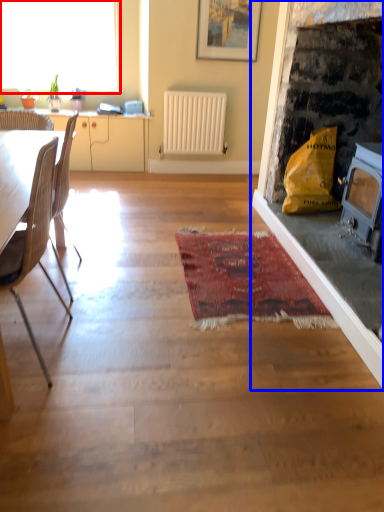
Question: Which point is closer to the camera, window (highlighted by a red box) or fireplace (highlighted by a blue box)?

Choices:
 (A) window
 (B) fireplace

Answer: (B)